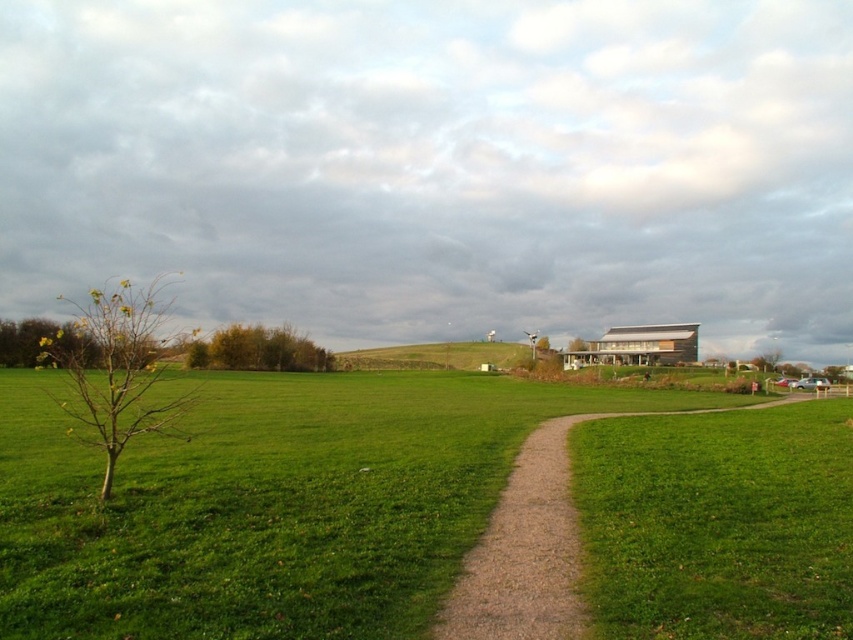
Can you confirm if green grassy at lower left is positioned to the right of green grassy hill at center?

Yes, green grassy at lower left is to the right of green grassy hill at center.

Does green grassy at lower left have a smaller size compared to green grassy hill at center?

Yes, green grassy at lower left is smaller than green grassy hill at center.

This screenshot has width=853, height=640. What do you see at coordinates (267, 506) in the screenshot?
I see `green grassy at lower left` at bounding box center [267, 506].

Image resolution: width=853 pixels, height=640 pixels. What are the coordinates of `green grassy at lower left` in the screenshot? It's located at (267, 506).

Is yellow-green leaves at left to the left of green grassy hill at center from the viewer's perspective?

Indeed, yellow-green leaves at left is positioned on the left side of green grassy hill at center.

Does point (155, 422) lie behind point (486, 349)?

No, it is in front of (486, 349).

Between point (115, 339) and point (474, 358), which one is positioned in front?

Point (115, 339) is in front.

Where is `yellow-green leaves at left`? The image size is (853, 640). yellow-green leaves at left is located at coordinates (115, 368).

Is yellow-green leaves at left closer to camera compared to green leafy tree at center?

Yes, yellow-green leaves at left is closer to the viewer.

Does yellow-green leaves at left appear over green leafy tree at center?

Indeed, yellow-green leaves at left is positioned over green leafy tree at center.

Is point (119, 348) positioned before point (259, 352)?

Yes, it is.

Image resolution: width=853 pixels, height=640 pixels. I want to click on yellow-green leaves at left, so click(115, 368).